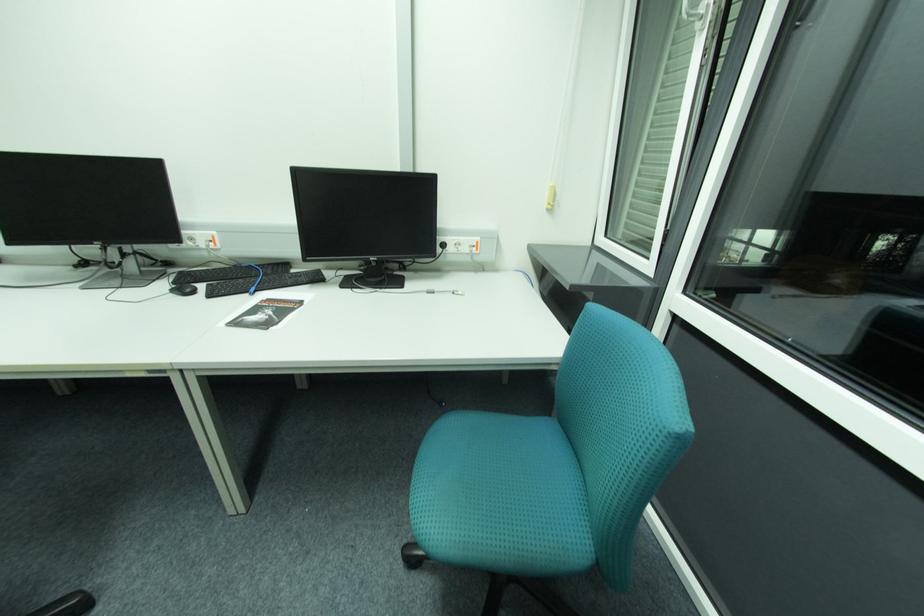
What do you see at coordinates (497, 483) in the screenshot? I see `the blue chair sitting surface` at bounding box center [497, 483].